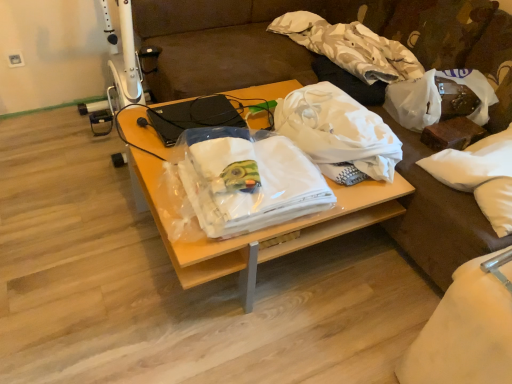
Question: Could you tell me if white cotton cloth at upper center, placed as the 2th cloth when sorted from bottom to top, is facing white matte plastic bag at center, which is counted as the first plastic bag, starting from the left?

Choices:
 (A) no
 (B) yes

Answer: (A)

Question: Is white cotton cloth at upper center, the first cloth from the top, at the left side of white matte plastic bag at center, which is counted as the first plastic bag, starting from the left?

Choices:
 (A) yes
 (B) no

Answer: (B)

Question: Can white matte plastic bag at center, which appears as the 2th plastic bag when viewed from the right, be found inside white cotton cloth at upper center, the first cloth from the top?

Choices:
 (A) no
 (B) yes

Answer: (A)

Question: Considering the relative sizes of white cotton cloth at upper center, placed as the 2th cloth when sorted from bottom to top, and white matte plastic bag at center, which appears as the 2th plastic bag when viewed from the right, in the image provided, is white cotton cloth at upper center, placed as the 2th cloth when sorted from bottom to top, smaller than white matte plastic bag at center, which appears as the 2th plastic bag when viewed from the right,?

Choices:
 (A) yes
 (B) no

Answer: (B)

Question: Considering the relative positions of white cotton cloth at upper center, the first cloth from the top, and white matte plastic bag at center, which appears as the 2th plastic bag when viewed from the right, in the image provided, is white cotton cloth at upper center, the first cloth from the top, behind white matte plastic bag at center, which appears as the 2th plastic bag when viewed from the right,?

Choices:
 (A) yes
 (B) no

Answer: (A)

Question: Is white fabric at center bigger or smaller than white fabric at center, which is counted as the second cloth, starting from the back?

Choices:
 (A) small
 (B) big

Answer: (B)

Question: Does point (330, 225) appear closer or farther from the camera than point (233, 200)?

Choices:
 (A) closer
 (B) farther

Answer: (B)

Question: Is white fabric at center in front of or behind white fabric at center, placed as the first cloth when sorted from front to back, in the image?

Choices:
 (A) behind
 (B) front

Answer: (A)

Question: Considering the positions of white fabric at center and white fabric at center, the 2th cloth viewed from the top, in the image, is white fabric at center wider or thinner than white fabric at center, the 2th cloth viewed from the top,?

Choices:
 (A) wide
 (B) thin

Answer: (A)

Question: Is point (216, 185) closer or farther from the camera than point (167, 6)?

Choices:
 (A) farther
 (B) closer

Answer: (B)

Question: In terms of height, does white fabric at center, the 2th cloth viewed from the top, look taller or shorter compared to white fabric couch at center?

Choices:
 (A) short
 (B) tall

Answer: (B)

Question: Considering the positions of white fabric at center, the 2th cloth viewed from the top, and white fabric couch at center in the image, is white fabric at center, the 2th cloth viewed from the top, bigger or smaller than white fabric couch at center?

Choices:
 (A) big
 (B) small

Answer: (B)

Question: Is white fabric at center, the 2th cloth viewed from the top, to the left or to the right of white fabric couch at center in the image?

Choices:
 (A) right
 (B) left

Answer: (A)

Question: Considering the positions of point (509, 129) and point (15, 51), is point (509, 129) closer or farther from the camera than point (15, 51)?

Choices:
 (A) closer
 (B) farther

Answer: (A)

Question: Considering the positions of white soft pillow at right and white plastic power outlet at upper left in the image, is white soft pillow at right bigger or smaller than white plastic power outlet at upper left?

Choices:
 (A) big
 (B) small

Answer: (A)